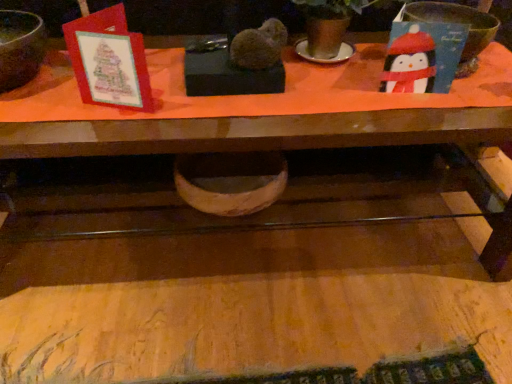
At what (x,y) coordinates should I click in order to perform the action: click on free point behind wooden table at lower center. Please return your answer as a coordinate pair (x, y). Image resolution: width=512 pixels, height=384 pixels. Looking at the image, I should click on (251, 260).